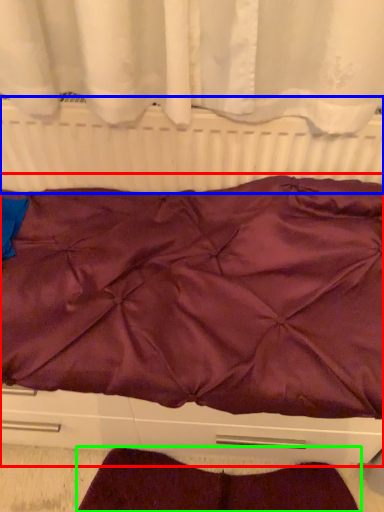
Question: Considering the real-world distances, which object is farthest from furniture (highlighted by a red box)? radiator (highlighted by a blue box) or blanket (highlighted by a green box)?

Choices:
 (A) radiator
 (B) blanket

Answer: (B)